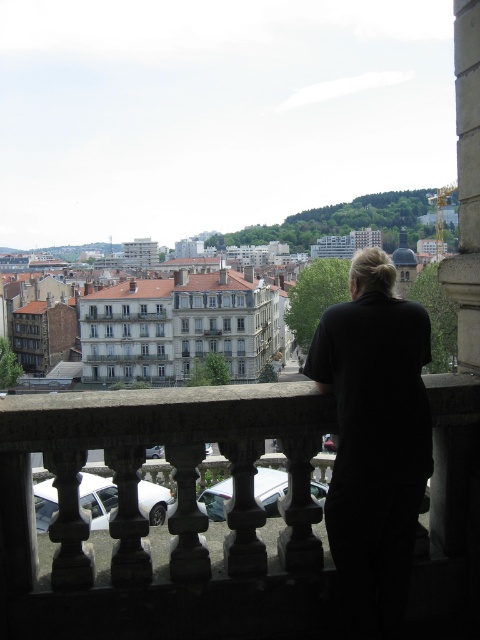
Question: Among these objects, which one is farthest from the camera?

Choices:
 (A) stone balustrade at center
 (B) black fabric at center

Answer: (B)

Question: Can you confirm if stone balustrade at center is positioned to the left of black fabric at center?

Choices:
 (A) no
 (B) yes

Answer: (B)

Question: Is stone balustrade at center positioned in front of black fabric at center?

Choices:
 (A) yes
 (B) no

Answer: (A)

Question: Does stone balustrade at center lie in front of black fabric at center?

Choices:
 (A) no
 (B) yes

Answer: (B)

Question: Among these points, which one is farthest from the camera?

Choices:
 (A) (371, 609)
 (B) (287, 424)

Answer: (B)